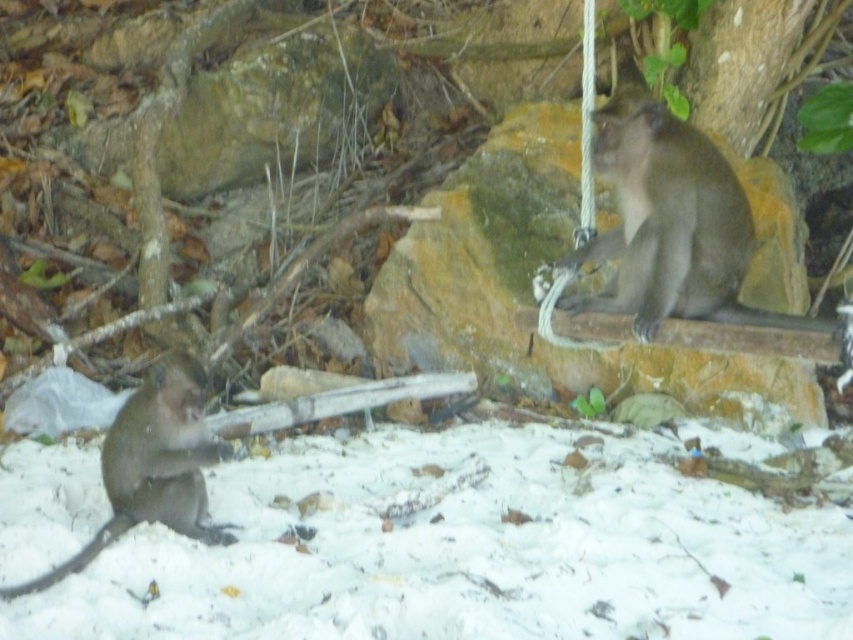
Which is below, gray furry monkey at upper right or brown furry monkey at lower left?

brown furry monkey at lower left is below.

Does gray furry monkey at upper right have a greater width compared to brown furry monkey at lower left?

Yes.

Locate an element on the screen. gray furry monkey at upper right is located at coordinates (670, 225).

Which is behind, point (381, 305) or point (695, 180)?

Positioned behind is point (381, 305).

Is smooth brown rock at upper right thinner than gray furry monkey at upper right?

Incorrect, smooth brown rock at upper right's width is not less than gray furry monkey at upper right's.

Describe the element at coordinates (529, 284) in the screenshot. I see `smooth brown rock at upper right` at that location.

What are the coordinates of `smooth brown rock at upper right` in the screenshot? It's located at (529, 284).

Is white fluffy snow at lower left positioned at the back of brown furry monkey at lower left?

That is False.

Does white fluffy snow at lower left appear under brown furry monkey at lower left?

Yes.

This screenshot has width=853, height=640. I want to click on white fluffy snow at lower left, so click(467, 552).

This screenshot has width=853, height=640. I want to click on white fluffy snow at lower left, so click(x=467, y=552).